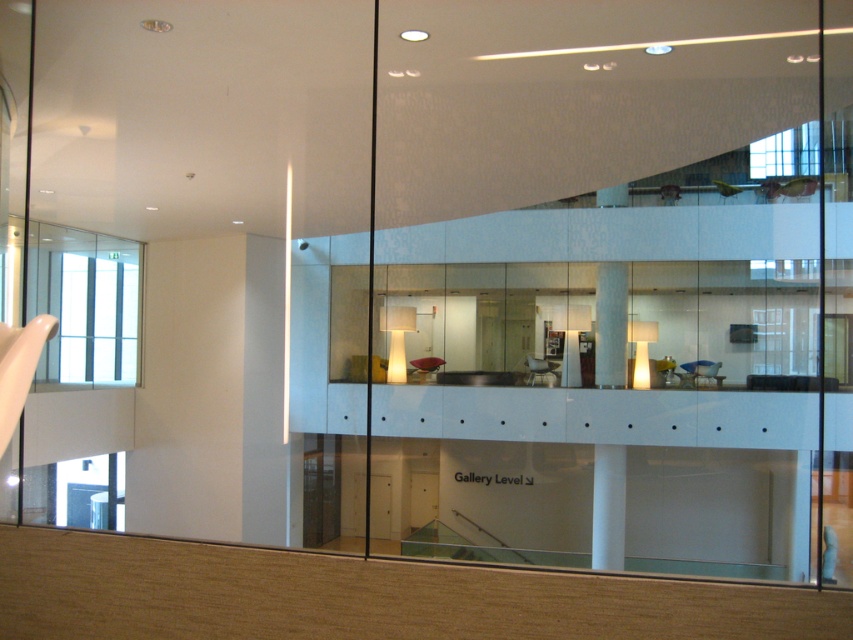
You are standing in the modern interior space and want to move from the carpeted area to the glass viewing platform. There are two white glossy structures in your path. Which one should you go around first, the white glossy balustrade at center or the white glossy pillar at center?

You should go around the white glossy pillar at center first because the white glossy balustrade at center is positioned on the right side of it, meaning the pillar is to the left and closer to your starting point.

Looking at this image, you are standing on the glass viewing platform and want to place a potted plant on the transparent glass at upper center. However, there is a white glossy balustrade at center below it. Can you safely place the plant there without it falling over?

The transparent glass at upper center is located above the white glossy balustrade at center, so placing the potted plant there would be safe as the balustrade provides a barrier below to prevent it from falling.

You are an interior designer planning to place a large potted plant between the transparent glass at upper center and the white glossy balustrade at center. Given their widths, which object should the plant be closer to?

The transparent glass at upper center has a larger width than the white glossy balustrade at center, so the plant should be placed closer to the transparent glass at upper center to maintain balance.